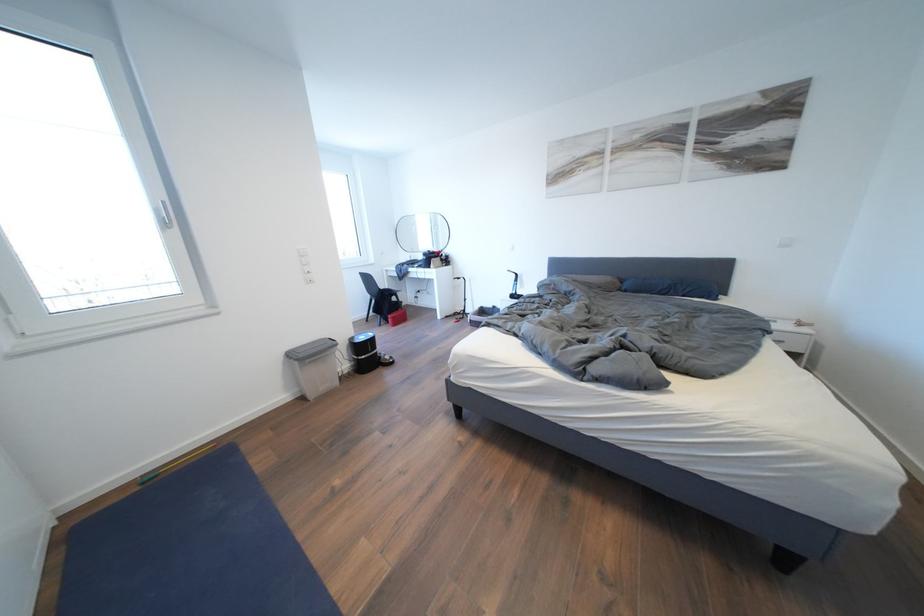
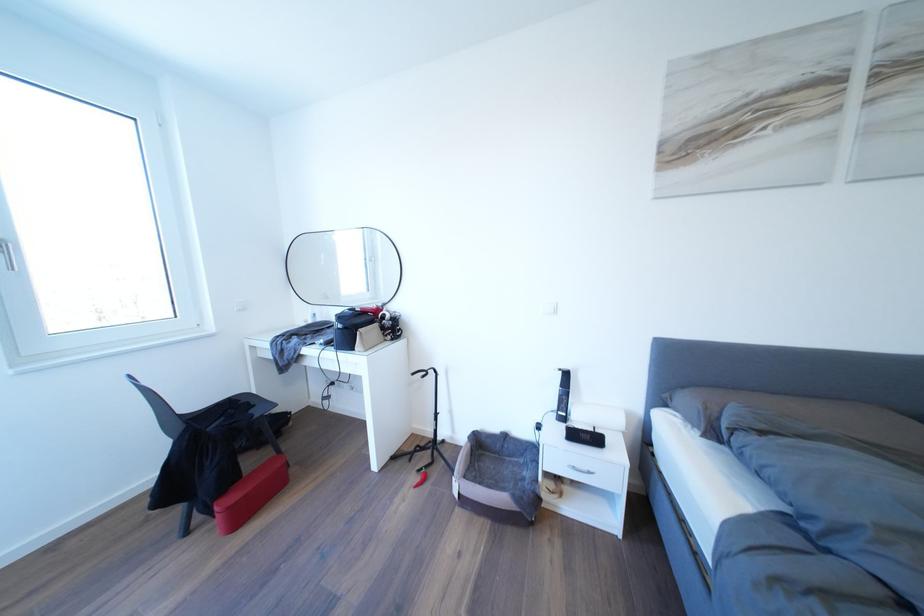
Question: What movement of the cameraman would produce the second image?

Choices:
 (A) Left
 (B) Right
 (C) Forward
 (D) Backward

Answer: (C)